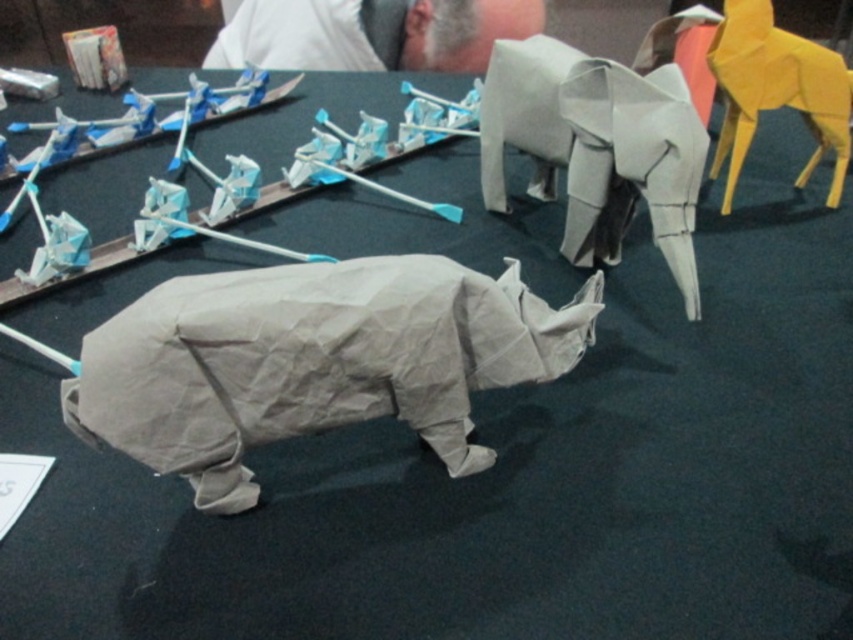
What do you see at coordinates (596, 148) in the screenshot?
I see `gray paper elephant at center` at bounding box center [596, 148].

Who is more forward, (693, 147) or (747, 90)?

Point (693, 147) is in front.

Identify the location of gray paper elephant at center. (596, 148).

The image size is (853, 640). What do you see at coordinates (370, 33) in the screenshot? I see `white paper man at upper center` at bounding box center [370, 33].

Does point (369, 42) come farther from viewer compared to point (846, 154)?

Yes, it is behind point (846, 154).

Where is `white paper man at upper center`? The width and height of the screenshot is (853, 640). white paper man at upper center is located at coordinates (370, 33).

Does gray paper elephant at center appear over white paper man at upper center?

No, gray paper elephant at center is not above white paper man at upper center.

Is gray paper elephant at center below white paper man at upper center?

Indeed, gray paper elephant at center is positioned under white paper man at upper center.

Who is more distant from viewer, (550,131) or (395,42)?

The point (395,42) is behind.

This screenshot has height=640, width=853. In order to click on gray paper elephant at center in this screenshot , I will do `click(596, 148)`.